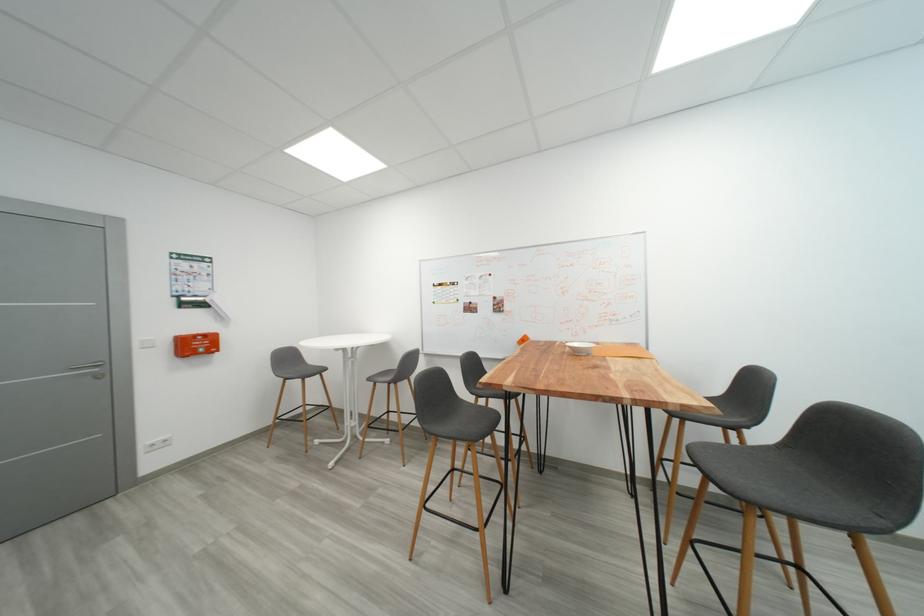
Which object does [580,347] point to?

It refers to a white ceramic bowl.